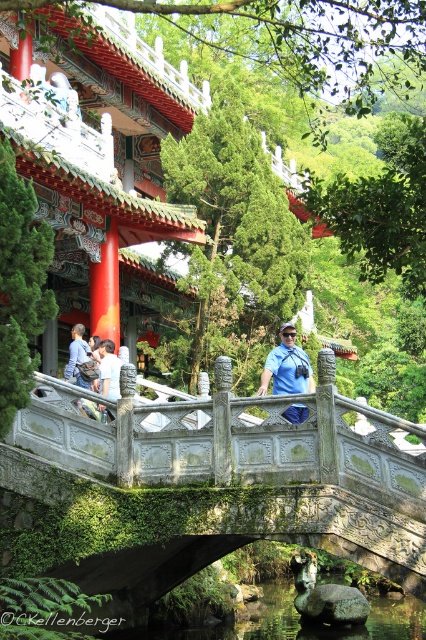
Can you confirm if blue fabric shirt at center is positioned to the right of blue denim jeans at left?

Correct, you'll find blue fabric shirt at center to the right of blue denim jeans at left.

Does blue fabric shirt at center have a greater width compared to blue denim jeans at left?

In fact, blue fabric shirt at center might be narrower than blue denim jeans at left.

Between point (294, 369) and point (71, 342), which one is positioned behind?

The point (71, 342) is behind.

The width and height of the screenshot is (426, 640). In order to click on blue fabric shirt at center in this screenshot , I will do `click(287, 365)`.

Can you confirm if green mossy stone bridge at center is shorter than clear water at bridge center?

No.

Between point (77, 556) and point (316, 637), which one is positioned behind?

The point (316, 637) is more distant.

Locate an element on the screen. The image size is (426, 640). green mossy stone bridge at center is located at coordinates (210, 484).

Which is behind, point (316, 637) or point (86, 356)?

The point (86, 356) is behind.

Is point (138, 636) positioned behind point (81, 358)?

No, it is not.

What are the coordinates of `clear water at bridge center` in the screenshot? It's located at (287, 620).